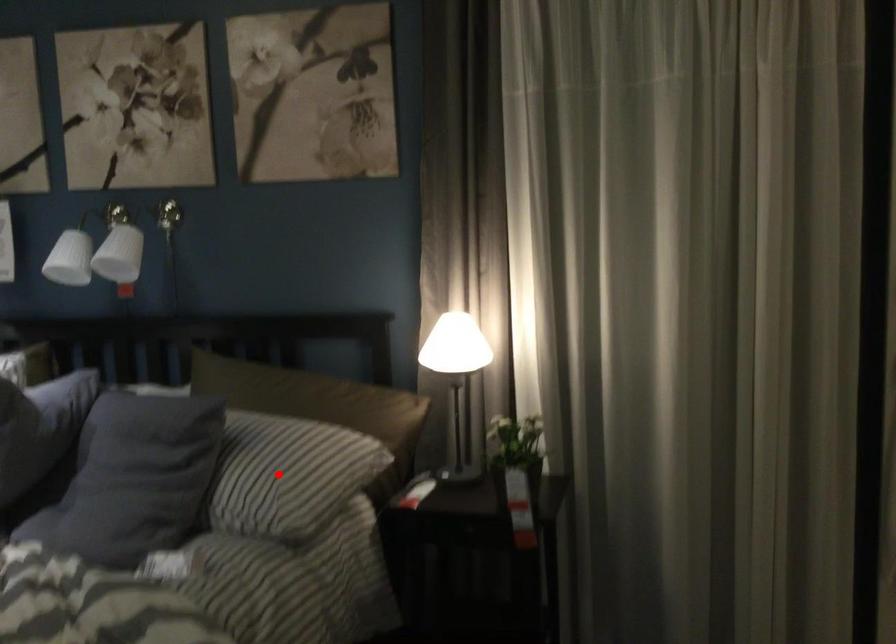
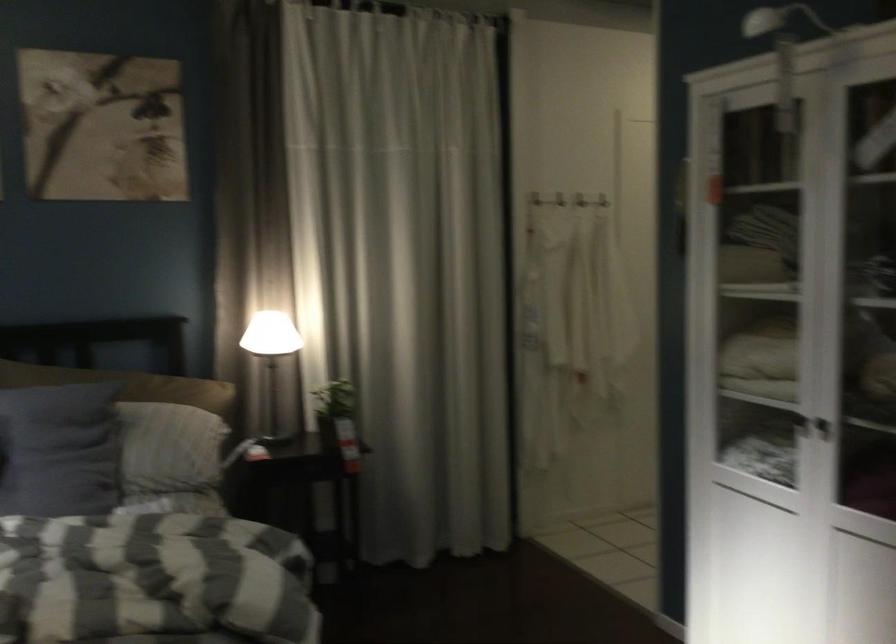
Question: A red point is marked in image1. In image2, is the corresponding 3D point closer to the camera or farther? Reply with the corresponding letter.

Choices:
 (A) The corresponding 3D point is closer.
 (B) The corresponding 3D point is farther.

Answer: (B)